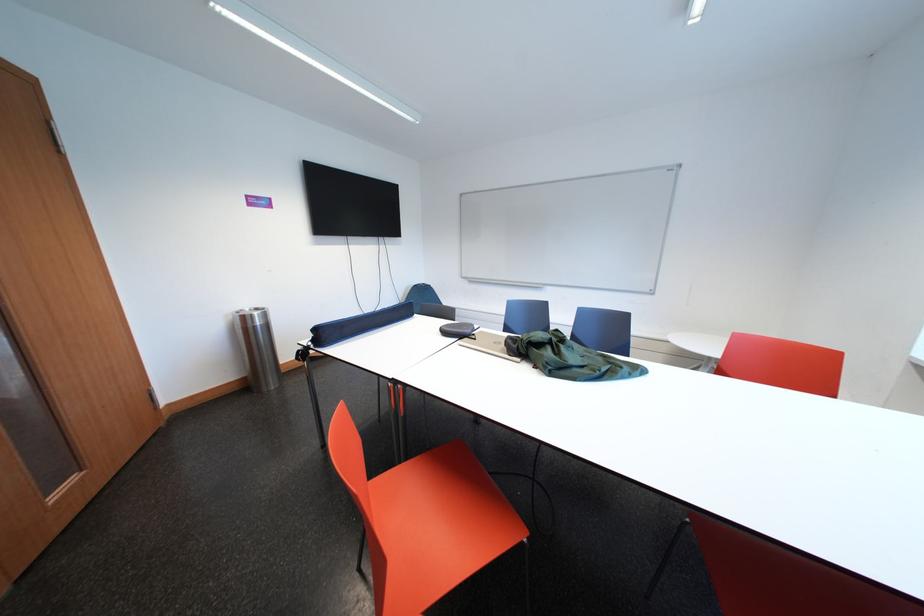
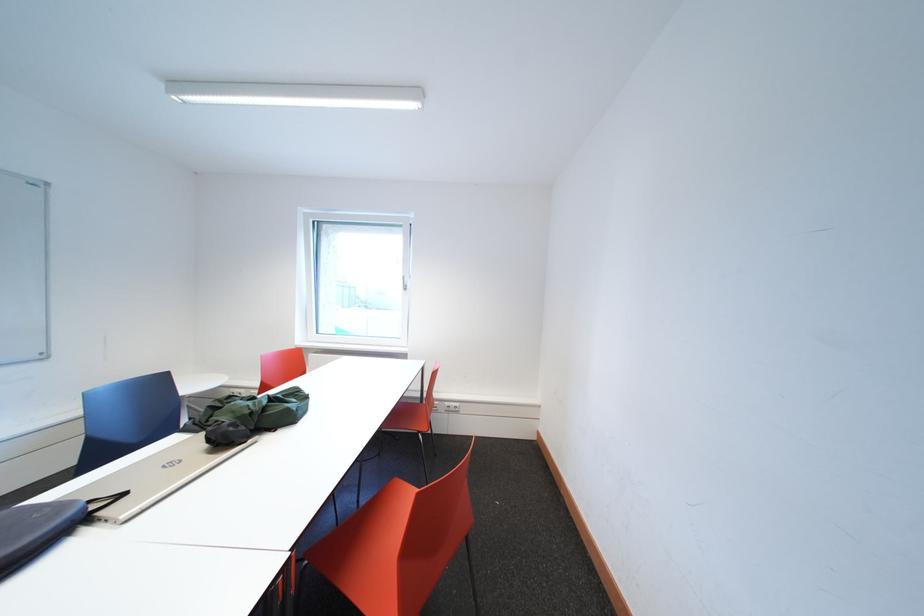
Question: I am providing you with two images of the same scene from different viewpoints. After the viewpoint changes to image2, which objects are now occluded?

Choices:
 (A) red chair sitting surface
 (B) silver laptop
 (C) white power outlet
 (D) none of these

Answer: (D)